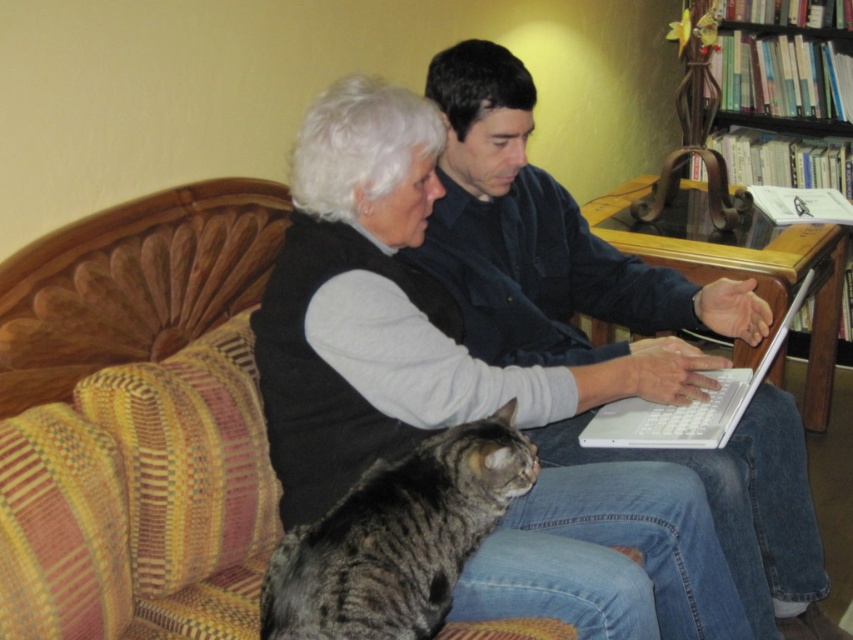
You are trying to place a small decorative item between the matte black shirt at center and the white plastic laptop at center on the couch. Based on their sizes, which object should you place the item closer to?

The matte black shirt at center might be wider than the white plastic laptop at center, so placing the item closer to the matte black shirt at center would provide more space.

You are a photographer trying to capture a clear photo of the white plastic laptop at center without the tabby fur cat at lower left blocking the view. Can you tell me if the cat is shorter or taller than the laptop?

The tabby fur cat at lower left is shorter than the white plastic laptop at center, so it won based on the description. Therefore, the cat is shorter than the laptop, which means it might not block the entire view of the laptop in the photo.

You are a photographer trying to capture a closeup of the tabby fur cat at lower left. The camera you are using has a focal length of 50mm. According to the coordinates provided, where should you position the camera to ensure the cat is centered in the frame?

The tabby fur cat at lower left is located at coordinates point (397, 538). To center it in the frame with a 50mm lens, position the camera so the center of the viewfinder aligns with those coordinates.